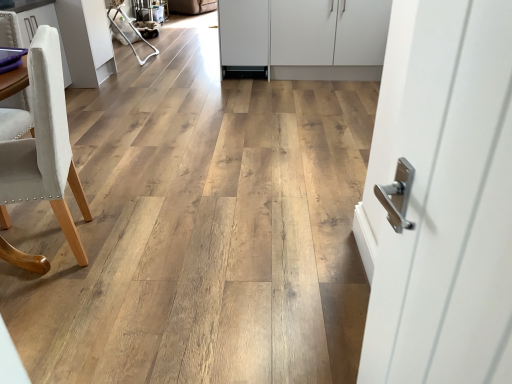
The width and height of the screenshot is (512, 384). I want to click on vacant space to the right of light beige fabric chair at left, so click(143, 239).